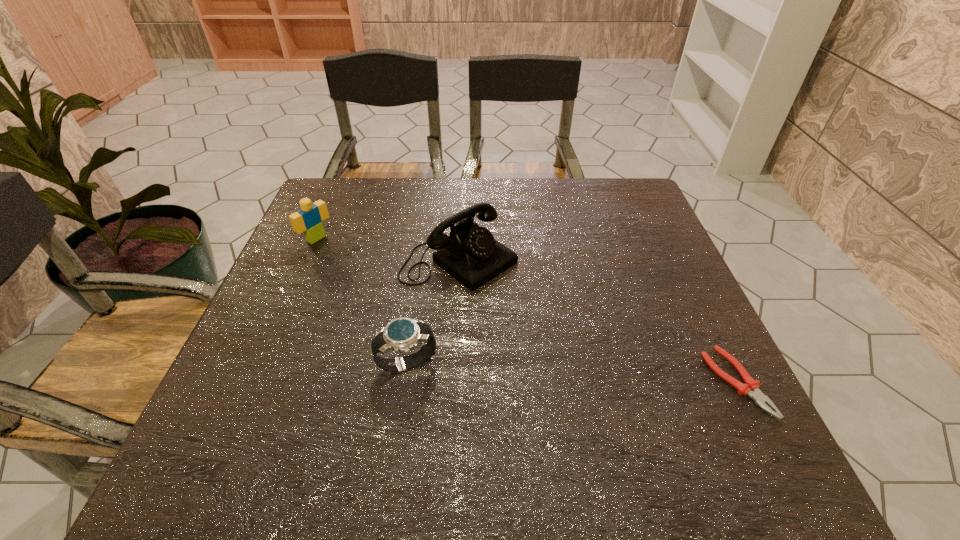
You are a GUI agent. You are given a task and a screenshot of the screen. Output one action in this format:
    pyautogui.click(x=<x>, y=<y>)
    Task: Click on the free region at the right edge
    This screenshot has width=960, height=540.
    Given the screenshot: What is the action you would take?
    pyautogui.click(x=622, y=247)

Find the location of a particular element. Image resolution: width=960 pixels, height=540 pixels. vacant space at the far left corner is located at coordinates (352, 222).

Identify the location of vacant point at the far right corner. (602, 184).

Where is `free area in between the telephone and the leftmost object`? free area in between the telephone and the leftmost object is located at coordinates pyautogui.click(x=388, y=249).

At what (x,y) coordinates should I click in order to perform the action: click on unoccupied position between the telephone and the leftmost object. Please return your answer as a coordinate pair (x, y). The image size is (960, 540). Looking at the image, I should click on (388, 249).

Where is `free spot between the watch and the Lego`? The width and height of the screenshot is (960, 540). free spot between the watch and the Lego is located at coordinates (362, 301).

Image resolution: width=960 pixels, height=540 pixels. Find the location of `free spot between the third tallest object and the pliers`. free spot between the third tallest object and the pliers is located at coordinates pyautogui.click(x=571, y=373).

Where is `unoccupied position between the leftmost object and the shortest object`? The image size is (960, 540). unoccupied position between the leftmost object and the shortest object is located at coordinates (526, 310).

What are the coordinates of `empty space that is in between the watch and the telephone` in the screenshot? It's located at (433, 312).

What are the coordinates of `vacant region between the shortest object and the watch` in the screenshot? It's located at (571, 373).